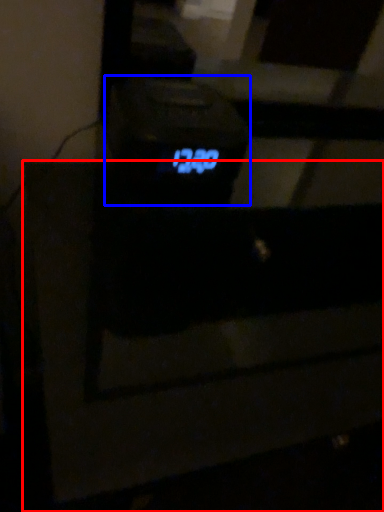
Question: Which point is closer to the camera, furniture (highlighted by a red box) or digital clock (highlighted by a blue box)?

Choices:
 (A) furniture
 (B) digital clock

Answer: (A)